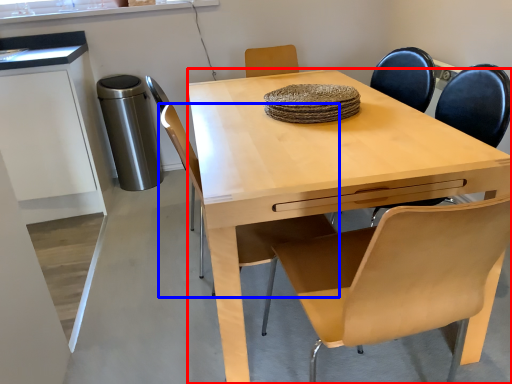
Question: Which object appears farthest to the camera in this image, desk (highlighted by a red box) or chair (highlighted by a blue box)?

Choices:
 (A) desk
 (B) chair

Answer: (B)